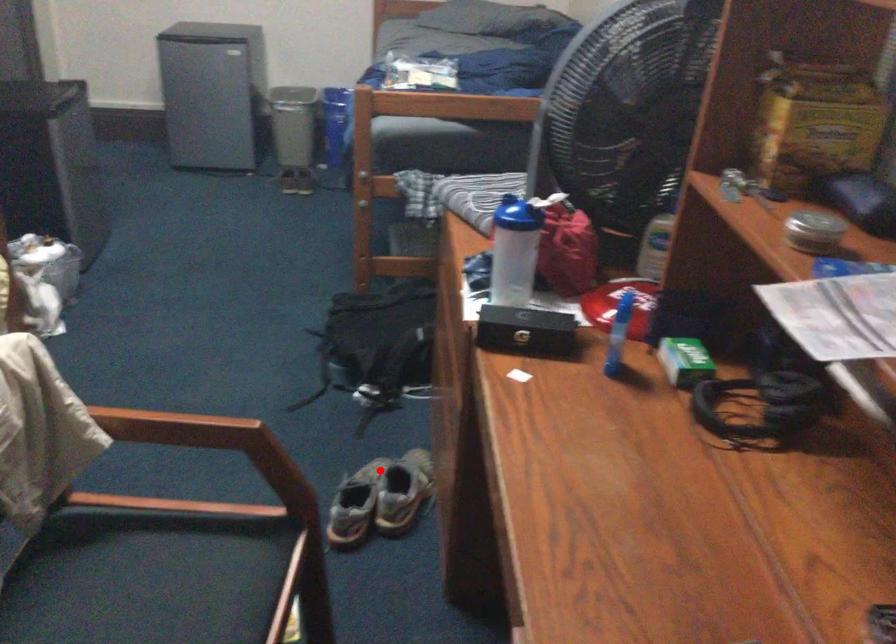
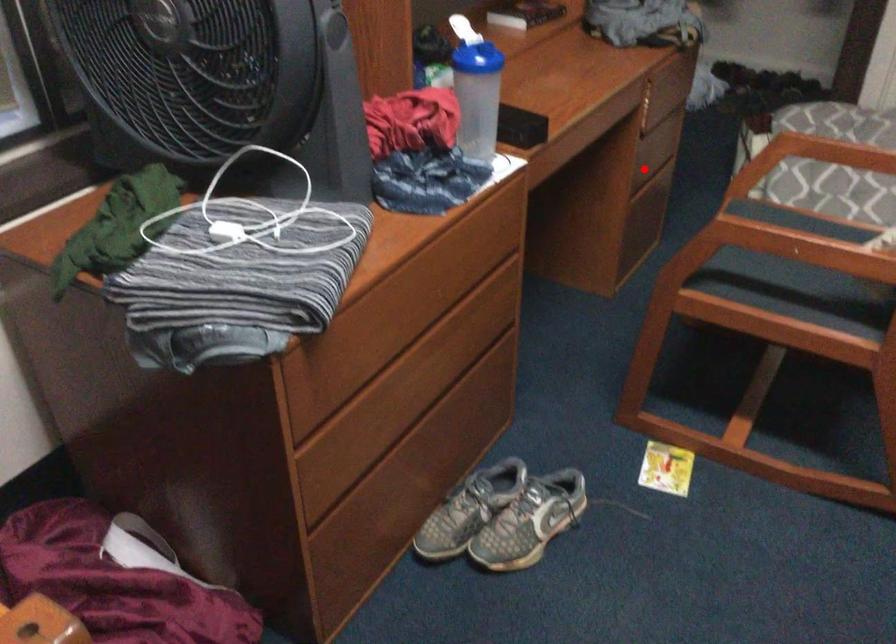
I am providing you with two images of the same scene from different viewpoints. A red point is marked on the first image and another point is marked on the second image. Do the highlighted points in image1 and image2 indicate the same real-world spot?

No